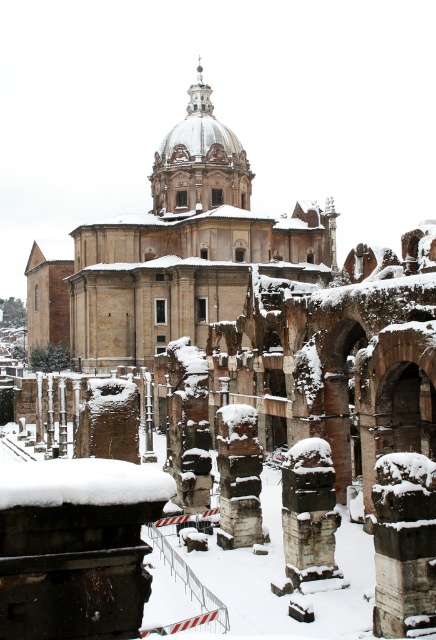
Question: Which object is the farthest from the beige stone church at center?

Choices:
 (A) white fluffy snow at lower left
 (B) snow-covered stone column at center

Answer: (B)

Question: Among these points, which one is nearest to the camera?

Choices:
 (A) (85, 490)
 (B) (282, 488)
 (C) (160, 176)

Answer: (A)

Question: Considering the relative positions of beige stone church at center and white fluffy snow at lower left in the image provided, where is beige stone church at center located with respect to white fluffy snow at lower left?

Choices:
 (A) below
 (B) above

Answer: (B)

Question: Is beige stone church at center thinner than snow-covered stone column at center?

Choices:
 (A) no
 (B) yes

Answer: (A)

Question: Among these points, which one is nearest to the camera?

Choices:
 (A) (299, 544)
 (B) (242, 307)
 (C) (77, 493)

Answer: (C)

Question: Considering the relative positions of white fluffy snow at lower left and snow-covered stone column at center in the image provided, where is white fluffy snow at lower left located with respect to snow-covered stone column at center?

Choices:
 (A) below
 (B) above

Answer: (B)